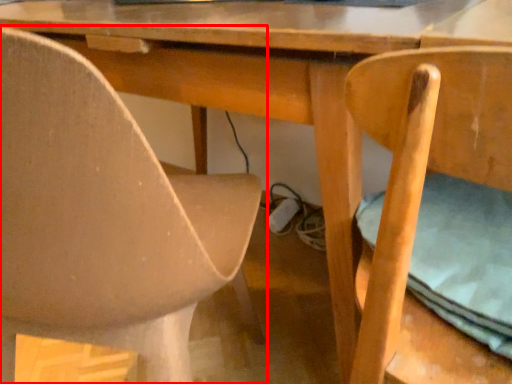
Question: From the image's perspective, considering the relative positions of chair (annotated by the red box) and chair in the image provided, where is chair (annotated by the red box) located with respect to the staircase?

Choices:
 (A) above
 (B) below

Answer: (A)